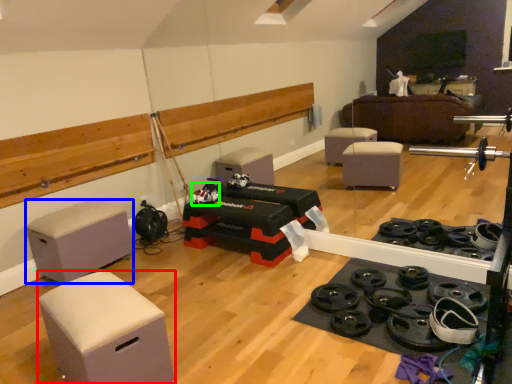
Question: Which is farther away from furniture (highlighted by a red box)? furniture (highlighted by a blue box) or toy (highlighted by a green box)?

Choices:
 (A) furniture
 (B) toy

Answer: (B)